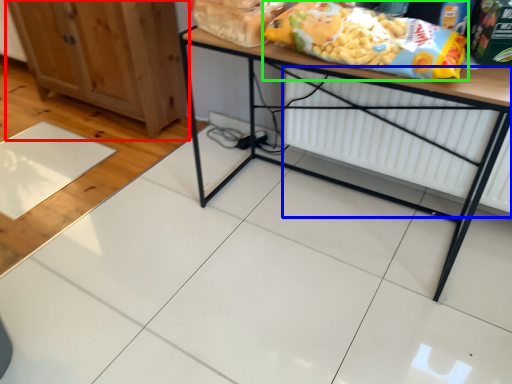
Question: Estimate the real-world distances between objects in this image. Which object is closer to cabinetry (highlighted by a red box), radiator (highlighted by a blue box) or cereal (highlighted by a green box)?

Choices:
 (A) radiator
 (B) cereal

Answer: (A)